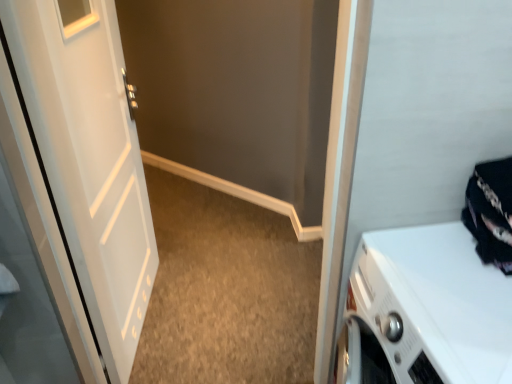
You are a GUI agent. You are given a task and a screenshot of the screen. Output one action in this format:
    pyautogui.click(x=<x>, y=<y>)
    Task: Click on the black fabric at right
    The width and height of the screenshot is (512, 384).
    Given the screenshot: What is the action you would take?
    pyautogui.click(x=490, y=212)

Where is `white glossy washing machine at lower right`? white glossy washing machine at lower right is located at coordinates (425, 311).

At what (x,y) coordinates should I click in order to perform the action: click on white matte door at left. Please return your answer as a coordinate pair (x, y). The width and height of the screenshot is (512, 384). Looking at the image, I should click on (89, 163).

Locate an element on the screen. The width and height of the screenshot is (512, 384). black fabric at right is located at coordinates (490, 212).

From the image's perspective, is white matte door at left above or below white glossy washing machine at lower right?

Clearly, from the image's perspective, white matte door at left is above white glossy washing machine at lower right.

Which point is more forward, (81, 325) or (471, 296)?

The point (471, 296) is closer to the camera.

Considering the relative positions of white matte door at left and white glossy washing machine at lower right in the image provided, is white matte door at left in front of white glossy washing machine at lower right?

No, it is not.

Would you consider white matte door at left to be distant from white glossy washing machine at lower right?

Yes, white matte door at left and white glossy washing machine at lower right are located far from each other.

Is white matte door at left facing away from black fabric at right?

No.

From the image's perspective, relative to black fabric at right, is white matte door at left above or below?

white matte door at left is above black fabric at right.

Is white matte door at left closer to the viewer compared to black fabric at right?

No, white matte door at left is further to the viewer.

Would you say white matte door at left is a long distance from black fabric at right?

white matte door at left is far away from black fabric at right.

Which is more to the right, white glossy washing machine at lower right or black fabric at right?

black fabric at right is more to the right.

Is white glossy washing machine at lower right looking in the opposite direction of black fabric at right?

No, black fabric at right is not at the back of white glossy washing machine at lower right.

Image resolution: width=512 pixels, height=384 pixels. What are the coordinates of `home appliance below the black fabric at right (from the image's perspective)` in the screenshot? It's located at (425, 311).

Can you confirm if white glossy washing machine at lower right is shorter than black fabric at right?

Incorrect, the height of white glossy washing machine at lower right does not fall short of that of black fabric at right.

Which object is positioned more to the left, white glossy washing machine at lower right or white matte door at left?

Positioned to the left is white matte door at left.

Is white glossy washing machine at lower right inside or outside of white matte door at left?

The correct answer is: outside.

From the image's perspective, is white glossy washing machine at lower right on top of white matte door at left?

No.

Considering the sizes of objects white glossy washing machine at lower right and white matte door at left in the image provided, who is smaller, white glossy washing machine at lower right or white matte door at left?

white matte door at left.

How much distance is there between black fabric at right and white matte door at left?

black fabric at right is 4.16 feet away from white matte door at left.

In terms of height, does black fabric at right look taller or shorter compared to white matte door at left?

Clearly, black fabric at right is shorter compared to white matte door at left.

Is black fabric at right in front of white matte door at left?

Yes, black fabric at right is closer to the camera.

Is white matte door at left completely or partially inside black fabric at right?

No, white matte door at left is located outside of black fabric at right.

Can you confirm if black fabric at right is bigger than white glossy washing machine at lower right?

Incorrect, black fabric at right is not larger than white glossy washing machine at lower right.

Is black fabric at right thinner than white glossy washing machine at lower right?

Yes.

Would you say black fabric at right is a long distance from white glossy washing machine at lower right?

That's not correct — black fabric at right is a little close to white glossy washing machine at lower right.

This screenshot has width=512, height=384. In order to click on home appliance located on the right of white matte door at left in this screenshot , I will do `click(425, 311)`.

At what (x,y) coordinates should I click in order to perform the action: click on clothing above the white matte door at left (from a real-world perspective). Please return your answer as a coordinate pair (x, y). This screenshot has height=384, width=512. Looking at the image, I should click on (490, 212).

Considering their positions, is black fabric at right positioned closer to white matte door at left than white glossy washing machine at lower right?

white glossy washing machine at lower right is closer to white matte door at left.

When comparing their distances from white glossy washing machine at lower right, does black fabric at right or white matte door at left seem closer?

black fabric at right is positioned closer to the anchor white glossy washing machine at lower right.

Considering their positions, is white matte door at left positioned closer to white glossy washing machine at lower right than black fabric at right?

Among the two, black fabric at right is located nearer to white glossy washing machine at lower right.

When comparing their distances from black fabric at right, does white glossy washing machine at lower right or white matte door at left seem further?

Among the two, white matte door at left is located further to black fabric at right.

Which object lies further to the anchor point white matte door at left, white glossy washing machine at lower right or black fabric at right?

The object further to white matte door at left is black fabric at right.

Based on their spatial positions, is white matte door at left or white glossy washing machine at lower right further from black fabric at right?

Based on the image, white matte door at left appears to be further to black fabric at right.

This screenshot has height=384, width=512. In order to click on home appliance located between white matte door at left and black fabric at right in the left-right direction in this screenshot , I will do `click(425, 311)`.